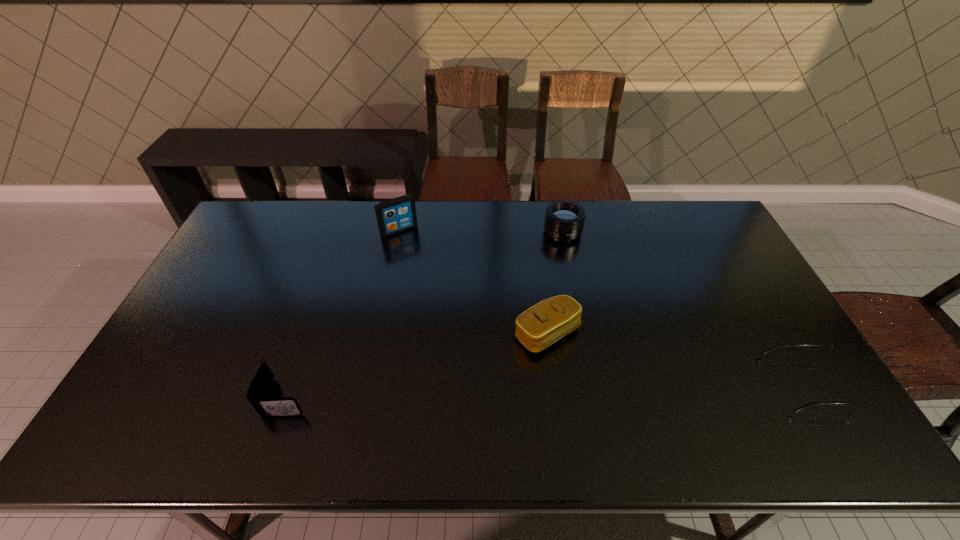
I want to click on empty space between the clutch bag and the wallet, so click(x=417, y=366).

Find the location of a particular element. free spot between the wallet and the spectacles is located at coordinates (547, 390).

Identify the location of vacant area that lies between the spectacles and the wallet. The image size is (960, 540). (547, 390).

This screenshot has height=540, width=960. What are the coordinates of `unoccupied area between the clutch bag and the telephoto lens` in the screenshot? It's located at (555, 282).

Find the location of `vacant region between the spectacles and the wallet`. vacant region between the spectacles and the wallet is located at coordinates (547, 390).

Where is `free space between the clutch bag and the leftmost object`? free space between the clutch bag and the leftmost object is located at coordinates (417, 366).

Find the location of a particular element. This screenshot has width=960, height=540. free space between the rightmost object and the clutch bag is located at coordinates (678, 359).

What are the coordinates of `free space between the wallet and the clutch bag` in the screenshot? It's located at (417, 366).

You are a GUI agent. You are given a task and a screenshot of the screen. Output one action in this format:
    pyautogui.click(x=<x>, y=<y>)
    Task: Click on the unoccupied position between the clutch bag and the leftmost object
    
    Given the screenshot: What is the action you would take?
    pyautogui.click(x=417, y=366)

Locate an element on the screen. object that is the fourth closest to the telephoto lens is located at coordinates (258, 390).